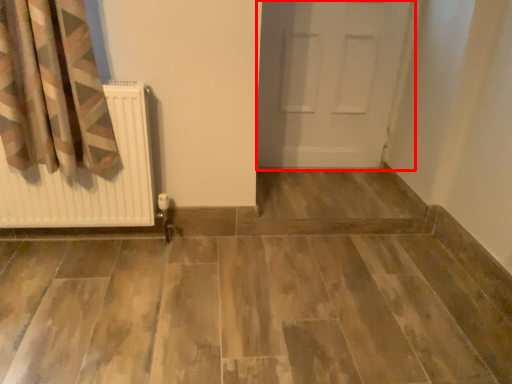
Question: From the image's perspective, where is door (annotated by the red box) located relative to radiator?

Choices:
 (A) above
 (B) below

Answer: (A)